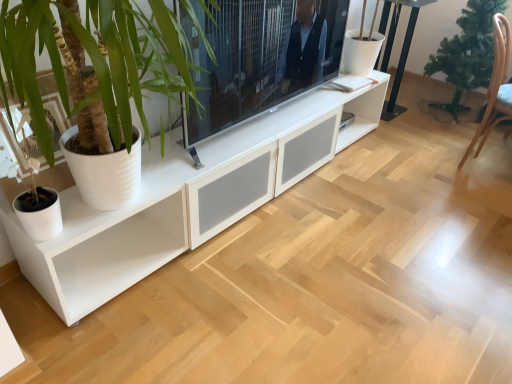
The image size is (512, 384). Identify the location of vacant space to the left of brown wooden armchair at right. (424, 158).